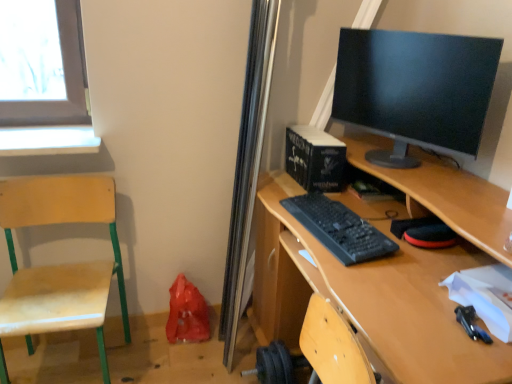
What do you see at coordinates (60, 265) in the screenshot? I see `wooden swivel chair at left` at bounding box center [60, 265].

The width and height of the screenshot is (512, 384). Describe the element at coordinates (373, 297) in the screenshot. I see `wooden desk at center` at that location.

Identify the location of wooden desk at center. (373, 297).

Find the location of a particular element. The width and height of the screenshot is (512, 384). black glossy monitor at upper right is located at coordinates (415, 90).

From the image's perspective, is wooden swivel chair at left above or below black plastic keyboard at center?

wooden swivel chair at left is below black plastic keyboard at center.

Is wooden swivel chair at left not close to black plastic keyboard at center?

Actually, wooden swivel chair at left and black plastic keyboard at center are a little close together.

In the image, is wooden swivel chair at left on the left side or the right side of black plastic keyboard at center?

In the image, wooden swivel chair at left appears on the left side of black plastic keyboard at center.

Is point (122, 316) in front of point (315, 204)?

No.

Is black plastic keyboard at center oriented away from black glossy monitor at upper right?

black plastic keyboard at center does not have its back to black glossy monitor at upper right.

Which is more to the right, black plastic keyboard at center or black glossy monitor at upper right?

From the viewer's perspective, black glossy monitor at upper right appears more on the right side.

Is black plastic keyboard at center in front of or behind black glossy monitor at upper right in the image?

In the image, black plastic keyboard at center appears behind black glossy monitor at upper right.

Is there a large distance between black plastic keyboard at center and black glossy monitor at upper right?

No, there isn't a large distance between black plastic keyboard at center and black glossy monitor at upper right.

Is black plastic keyboard at center inside or outside of wooden swivel chair at left?

black plastic keyboard at center is not enclosed by wooden swivel chair at left.

In terms of width, does black plastic keyboard at center look wider or thinner when compared to wooden swivel chair at left?

Clearly, black plastic keyboard at center has less width compared to wooden swivel chair at left.

From a real-world perspective, which object rests below the other?

wooden swivel chair at left.

Can you confirm if black plastic keyboard at center is positioned to the right of wooden swivel chair at left?

Correct, you'll find black plastic keyboard at center to the right of wooden swivel chair at left.

Is black glossy monitor at upper right behind black plastic keyboard at center?

No, it is in front of black plastic keyboard at center.

From the image's perspective, is black glossy monitor at upper right located above black plastic keyboard at center?

Yes, from the image's perspective, black glossy monitor at upper right is over black plastic keyboard at center.

Which point is more distant from viewer, (344, 107) or (294, 211)?

The point (344, 107) is farther from the camera.

From a real-world perspective, is black glossy monitor at upper right above or below black plastic keyboard at center?

Clearly, from a real-world perspective, black glossy monitor at upper right is above black plastic keyboard at center.

From the picture: From the image's perspective, is black plastic keyboard at center located beneath wooden desk at center?

No.

Which object is positioned more to the left, black plastic keyboard at center or wooden desk at center?

From the viewer's perspective, black plastic keyboard at center appears more on the left side.

Considering the relative sizes of black plastic keyboard at center and wooden desk at center in the image provided, is black plastic keyboard at center shorter than wooden desk at center?

Correct, black plastic keyboard at center is not as tall as wooden desk at center.

Does black plastic keyboard at center contain wooden desk at center?

No, wooden desk at center is not a part of black plastic keyboard at center.

Is wooden swivel chair at left surrounding black glossy monitor at upper right?

No, wooden swivel chair at left does not contain black glossy monitor at upper right.

Is point (117, 273) farther from camera compared to point (369, 74)?

That is True.

Is wooden swivel chair at left in contact with black glossy monitor at upper right?

wooden swivel chair at left is not next to black glossy monitor at upper right, and they're not touching.

Considering the positions of objects wooden swivel chair at left and black glossy monitor at upper right in the image provided, who is in front, wooden swivel chair at left or black glossy monitor at upper right?

black glossy monitor at upper right is in front.

Considering the positions of objects wooden swivel chair at left and wooden desk at center in the image provided, who is behind, wooden swivel chair at left or wooden desk at center?

wooden swivel chair at left.

Considering the sizes of wooden swivel chair at left and wooden desk at center in the image, is wooden swivel chair at left taller or shorter than wooden desk at center?

wooden swivel chair at left is shorter than wooden desk at center.

Find the location of a particular element. desk above the wooden swivel chair at left (from a real-world perspective) is located at coordinates (373, 297).

Looking at this image, how many degrees apart are the facing directions of wooden swivel chair at left and wooden desk at center?

They differ by 89.5 degrees in their facing directions.

You are a GUI agent. You are given a task and a screenshot of the screen. Output one action in this format:
    pyautogui.click(x=<x>, y=<y>)
    Task: Click on the computer keyboard above the wooden swivel chair at left (from the image's perspective)
    
    Given the screenshot: What is the action you would take?
    pyautogui.click(x=339, y=228)

Locate an element on the screen. The height and width of the screenshot is (384, 512). computer monitor in front of the black plastic keyboard at center is located at coordinates (x=415, y=90).

Which object lies nearer to the anchor point wooden swivel chair at left, black glossy monitor at upper right or black plastic keyboard at center?

black plastic keyboard at center.

From the picture: Looking at the image, which one is located further to black glossy monitor at upper right, wooden swivel chair at left or wooden desk at center?

wooden swivel chair at left.

Which object lies further to the anchor point wooden swivel chair at left, black plastic keyboard at center or black glossy monitor at upper right?

black glossy monitor at upper right is further to wooden swivel chair at left.

Considering their positions, is wooden swivel chair at left positioned further to black plastic keyboard at center than black glossy monitor at upper right?

Based on the image, wooden swivel chair at left appears to be further to black plastic keyboard at center.

Based on their spatial positions, is wooden desk at center or black glossy monitor at upper right further from black plastic keyboard at center?

black glossy monitor at upper right is further to black plastic keyboard at center.

Considering their positions, is wooden desk at center positioned further to black glossy monitor at upper right than black plastic keyboard at center?

Based on the image, wooden desk at center appears to be further to black glossy monitor at upper right.

Considering their positions, is wooden desk at center positioned closer to black glossy monitor at upper right than wooden swivel chair at left?

wooden desk at center.

Considering their positions, is black glossy monitor at upper right positioned closer to wooden desk at center than black plastic keyboard at center?

black plastic keyboard at center is closer to wooden desk at center.

Find the location of a particular element. computer keyboard between wooden swivel chair at left and wooden desk at center in the horizontal direction is located at coordinates (339, 228).

Find the location of `desk between wooden swivel chair at left and black glossy monitor at upper right from left to right`. desk between wooden swivel chair at left and black glossy monitor at upper right from left to right is located at coordinates (373, 297).

At what (x,y) coordinates should I click in order to perform the action: click on computer keyboard located between wooden swivel chair at left and black glossy monitor at upper right in the left-right direction. Please return your answer as a coordinate pair (x, y). Looking at the image, I should click on (339, 228).

I want to click on computer keyboard between black glossy monitor at upper right and wooden desk at center from top to bottom, so click(339, 228).